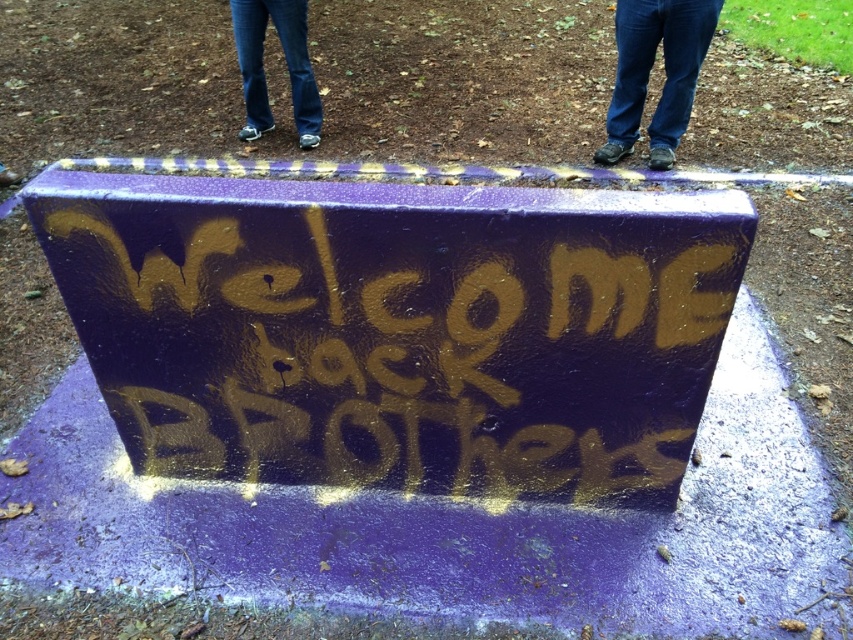
Who is shorter, gold spray paint graffiti at center or jeans at center?

gold spray paint graffiti at center

From the picture: Who is positioned more to the right, gold spray paint graffiti at center or jeans at center?

From the viewer's perspective, jeans at center appears more on the right side.

Locate an element on the screen. The image size is (853, 640). gold spray paint graffiti at center is located at coordinates (401, 342).

Between gold spray paint graffiti at center and jeans at upper center, which one is positioned lower?

gold spray paint graffiti at center is lower down.

Who is more distant from viewer, [509,445] or [263,120]?

The point [263,120] is more distant.

The width and height of the screenshot is (853, 640). Identify the location of gold spray paint graffiti at center. coord(401,342).

Which is above, jeans at center or jeans at upper center?

jeans at upper center is above.

The width and height of the screenshot is (853, 640). I want to click on jeans at center, so click(x=648, y=74).